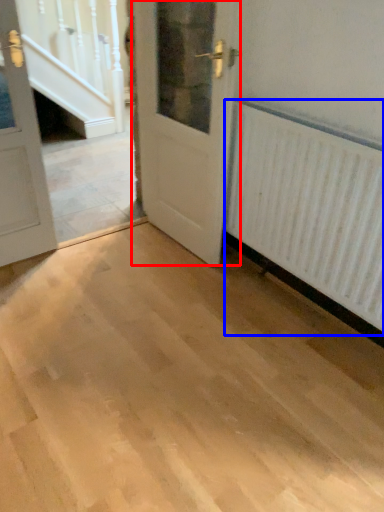
Question: Which object is closer to the camera taking this photo, door (highlighted by a red box) or radiator (highlighted by a blue box)?

Choices:
 (A) door
 (B) radiator

Answer: (B)